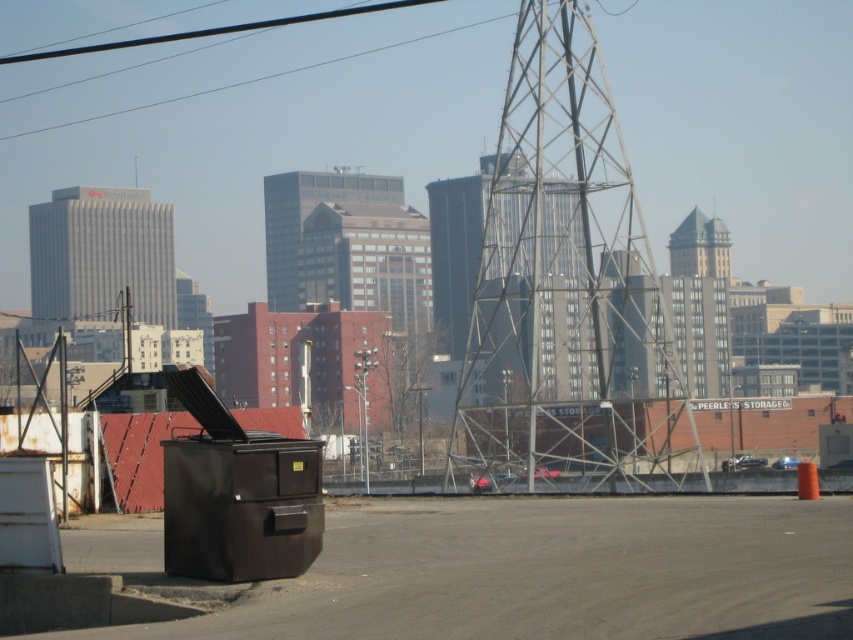
Based on the photo, you are a drone operator trying to fly a drone from the gray concrete skyscraper at center to the black wire at upper center. Based on their positions, will the drone have a clear path without obstacles between them?

The gray concrete skyscraper at center is in front of the black wire at upper center, so the drone will not have a clear path because the skyscraper is blocking the way between them.

You are a drone operator tasked with flying a drone between the gray concrete skyscraper at center and the green glass tower at upper center. The drone has a maximum flight distance of 50 meters. Can the drone safely complete this flight without exceeding its range?

The gray concrete skyscraper at center is 49.39 meters from the green glass tower at upper center. Since the distance is less than the drone operator has a maximum flight distance of 50 meters, the drone can safely complete the flight without exceeding its range.

You are standing in the urban landscape scene and need to determine which of the two points, point (93, 216) or point (717, 264), is closer to you. Based on the scene description, which point is nearer?

Point (93, 216) is closer to you because it is further to the viewer than point (717, 264).